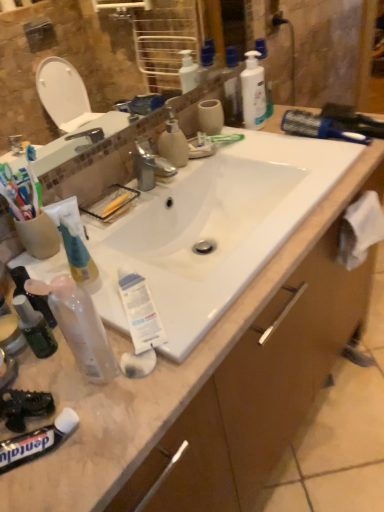
Image resolution: width=384 pixels, height=512 pixels. Identify the location of free space to the left of transparent plastic spray bottle at lower left, positioned as the 1th toiletry in bottom-to-top order. (51, 375).